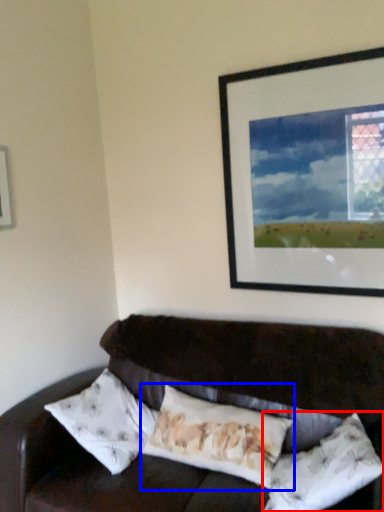
Question: Among these objects, which one is farthest to the camera, pillow (highlighted by a red box) or pillow (highlighted by a blue box)?

Choices:
 (A) pillow
 (B) pillow

Answer: (B)